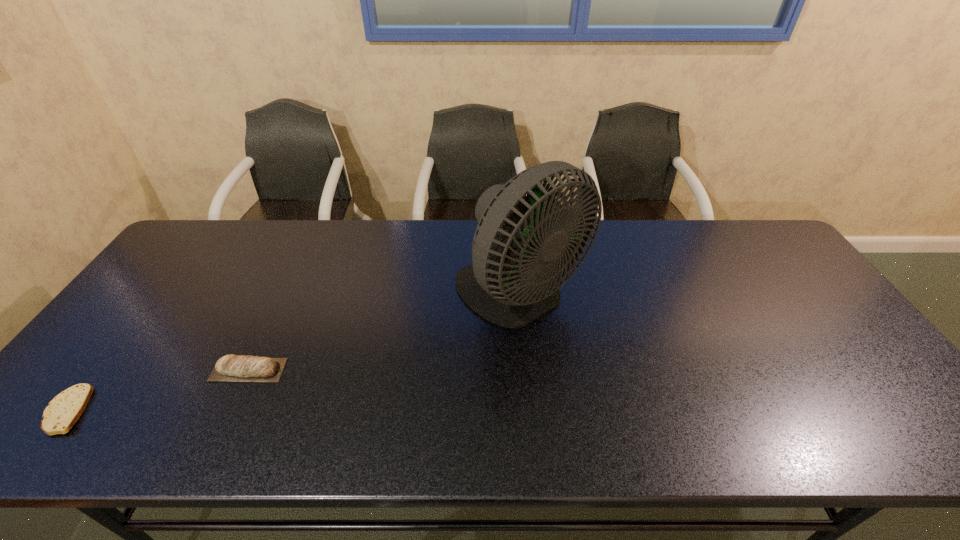
I want to click on free space between the leftmost object and the farther pita bread, so click(158, 390).

Find the location of a particular element. The width and height of the screenshot is (960, 540). free space between the fan and the second farthest object is located at coordinates (384, 333).

Where is `free spot between the tallest object and the left pita bread`? free spot between the tallest object and the left pita bread is located at coordinates (294, 353).

Where is `free space between the nearest object and the tallest object`? This screenshot has width=960, height=540. free space between the nearest object and the tallest object is located at coordinates (294, 353).

Locate an element on the screen. free space between the taller pita bread and the shortest object is located at coordinates (158, 390).

You are a GUI agent. You are given a task and a screenshot of the screen. Output one action in this format:
    pyautogui.click(x=<x>, y=<y>)
    Task: Click on the free space between the taller pita bread and the nearest object
    
    Given the screenshot: What is the action you would take?
    (158, 390)

Identify the location of free space between the leftmost object and the farther pita bread. (158, 390).

The width and height of the screenshot is (960, 540). What are the coordinates of `free space between the fan and the nearest object` in the screenshot? It's located at (294, 353).

Where is `empty space between the nearest object and the tallest object`? This screenshot has width=960, height=540. empty space between the nearest object and the tallest object is located at coordinates (294, 353).

This screenshot has width=960, height=540. I want to click on object that is the nearest to the shortest object, so click(230, 368).